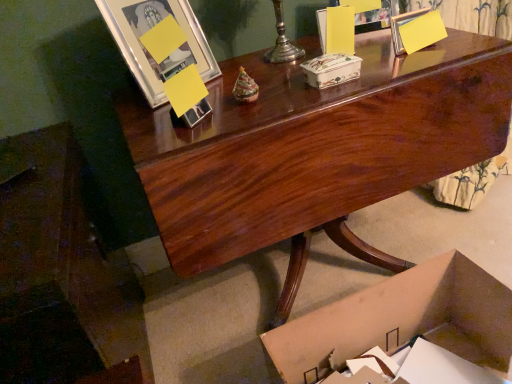
Identify the location of free point to the left of porcelain floral box at center, the second box when ordered from bottom to top. (269, 96).